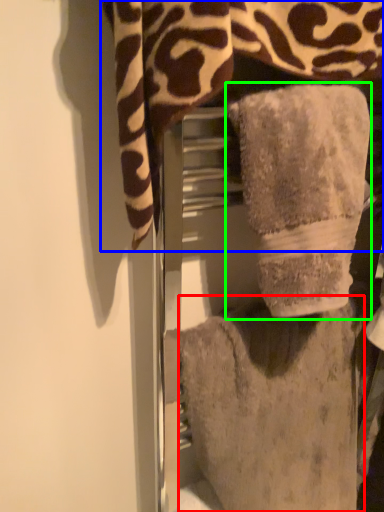
Question: Based on their relative distances, which object is nearer to towel (highlighted by a red box)? Choose from towel (highlighted by a blue box) and towel (highlighted by a green box).

Choices:
 (A) towel
 (B) towel

Answer: (B)